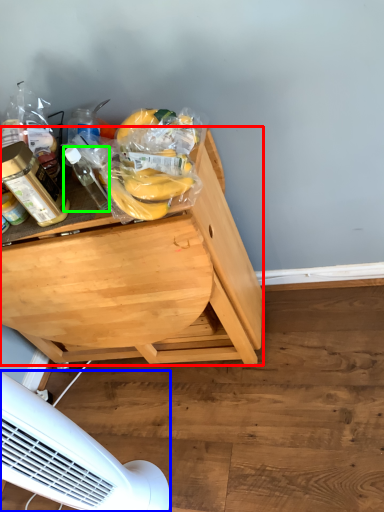
Question: Which is farther away from desk (highlighted by a red box)? mechanical fan (highlighted by a blue box) or bottle (highlighted by a green box)?

Choices:
 (A) mechanical fan
 (B) bottle

Answer: (A)